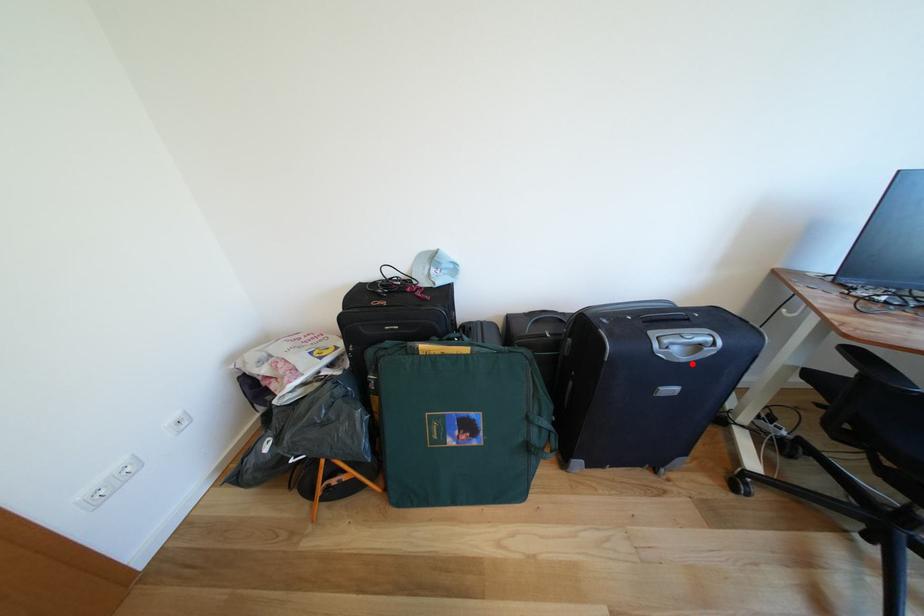
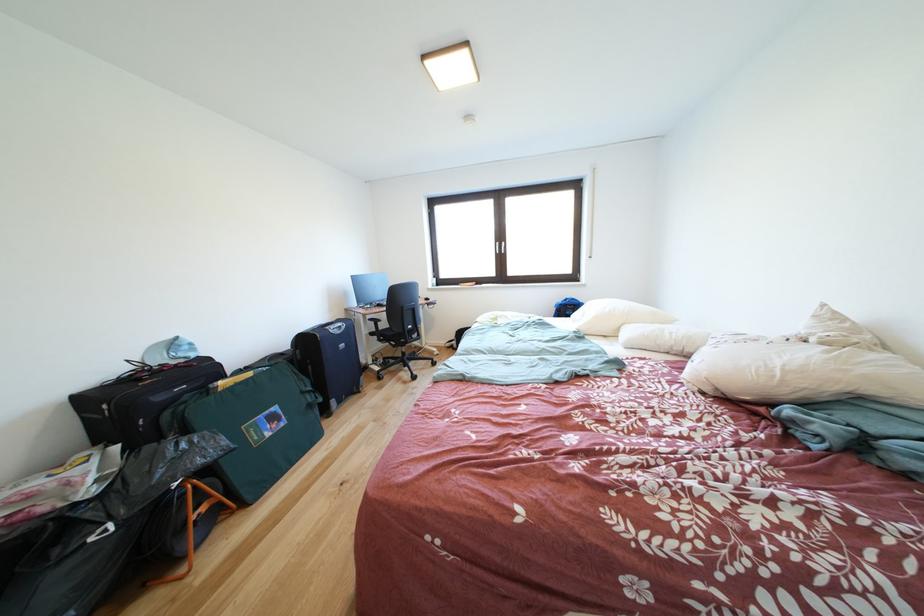
Find the pixel in the second image that matches the highlighted location in the first image.

(347, 337)